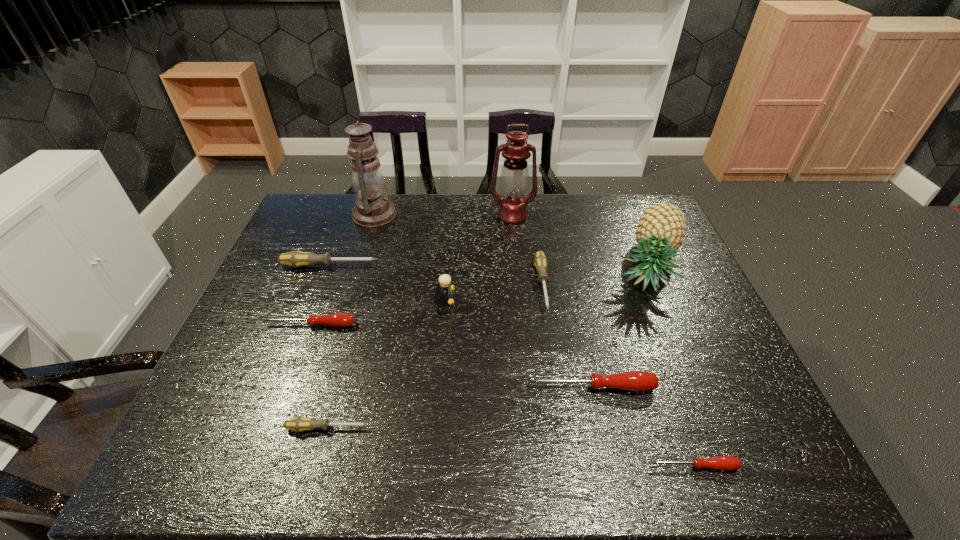
At what (x,y) coordinates should I click in order to perform the action: click on free space between the second biggest red screwdriver and the second biggest gray screwdriver. Please return your answer as a coordinate pair (x, y). The width and height of the screenshot is (960, 540). Looking at the image, I should click on (426, 305).

The height and width of the screenshot is (540, 960). Find the location of `free space between the fourth farthest screwdriver and the left oil lamp`. free space between the fourth farthest screwdriver and the left oil lamp is located at coordinates (483, 301).

Where is `empty space between the rightmost gray screwdriver and the biggest gray screwdriver`? The image size is (960, 540). empty space between the rightmost gray screwdriver and the biggest gray screwdriver is located at coordinates (436, 275).

Image resolution: width=960 pixels, height=540 pixels. Identify the location of vacant space that's between the right oil lamp and the ninth farthest object. (420, 322).

This screenshot has width=960, height=540. Find the location of `unoccupied position between the leftmost red screwdriver and the pineapple`. unoccupied position between the leftmost red screwdriver and the pineapple is located at coordinates (479, 295).

Locate an element on the screen. unoccupied area between the biggest gray screwdriver and the third nearest screwdriver is located at coordinates (461, 326).

The height and width of the screenshot is (540, 960). I want to click on object that is the fifth closest to the third tallest object, so click(x=444, y=280).

Locate which object is the fourth closest to the rightmost gray screwdriver. Please provide its 2D coordinates. Your answer should be formatted as a tuple, i.e. [(x, y)], where the tuple contains the x and y coordinates of a point satisfying the conditions above.

[(444, 280)]

This screenshot has height=540, width=960. Find the location of `screwdriver that can be found as the fifth closest to the third tallest object`. screwdriver that can be found as the fifth closest to the third tallest object is located at coordinates (298, 424).

Identify the location of screwdriver that is the fifth closest to the red oil lamp. This screenshot has height=540, width=960. (298, 424).